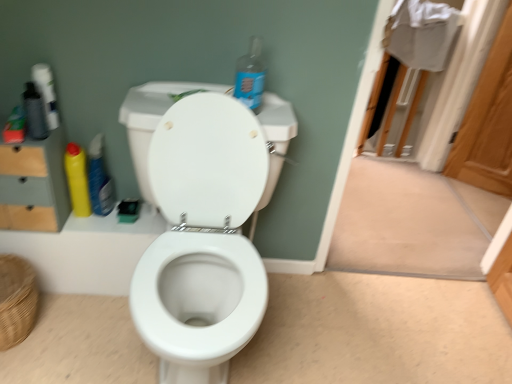
At what (x,y) coordinates should I click in order to perform the action: click on free space between white glossy toilet at center and woven brown basket at lower left. Please return your answer as a coordinate pair (x, y). This screenshot has height=384, width=512. Looking at the image, I should click on (78, 334).